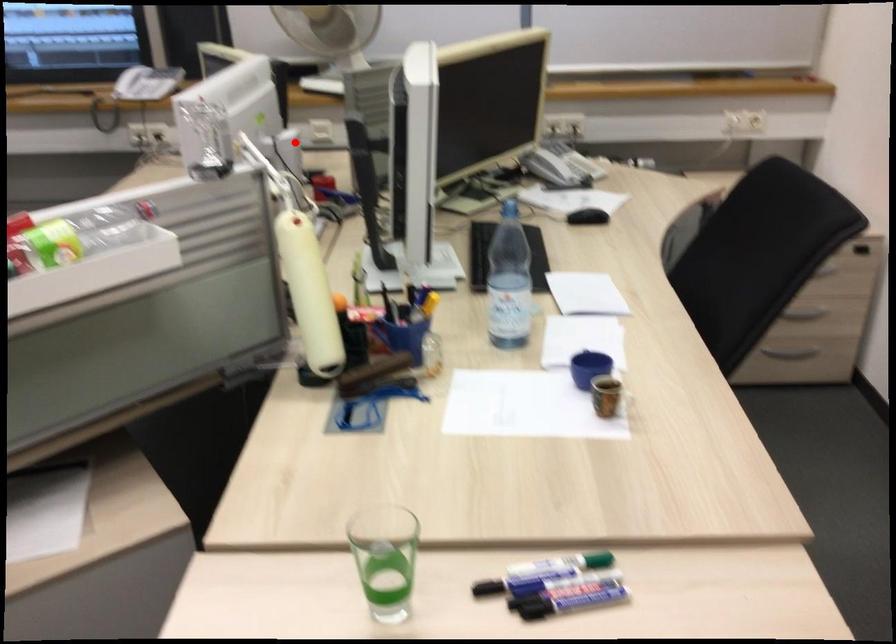
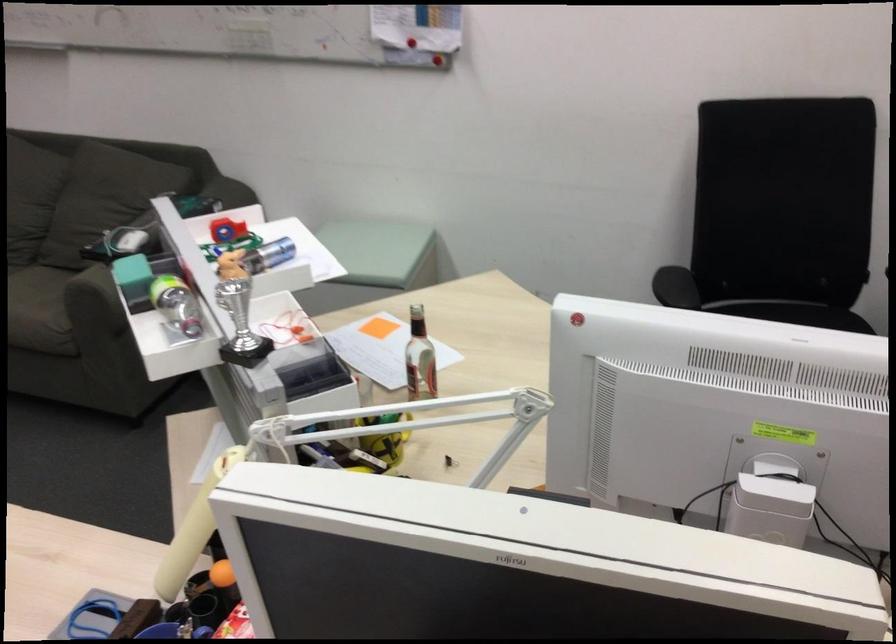
Question: I am providing you with two images of the same scene from different viewpoints. A red point is shown in image1. For the corresponding object point in image2, is it positioned nearer or farther from the camera?

Choices:
 (A) Nearer
 (B) Farther

Answer: (A)